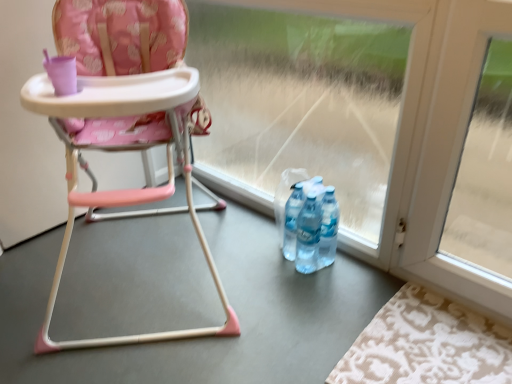
The height and width of the screenshot is (384, 512). What are the coordinates of `vacant space to the right of matte plastic highchair at center` in the screenshot? It's located at (307, 296).